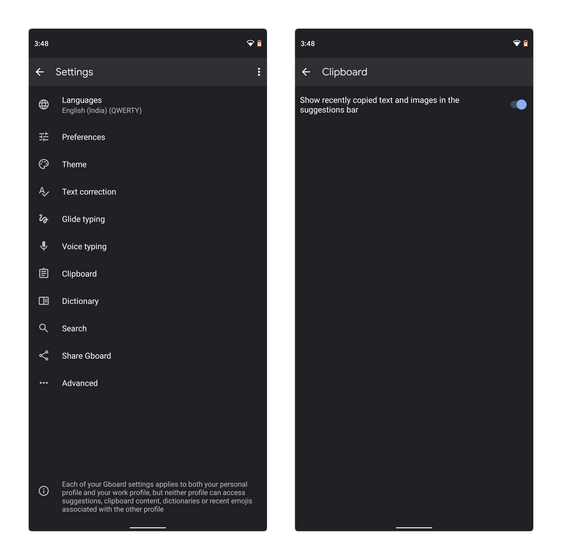
At what (x,y) coordinates should I click in order to perform the action: click on toggle switch. Please return your answer as a coordinate pair (x, y). The image size is (562, 560). Looking at the image, I should click on (518, 101).